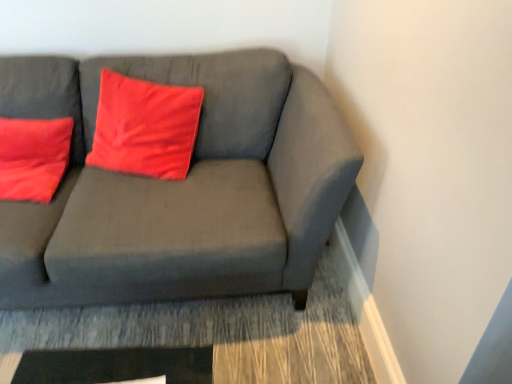
Question: Does point (159, 139) appear closer or farther from the camera than point (295, 235)?

Choices:
 (A) closer
 (B) farther

Answer: (B)

Question: In the image, is matte red pillow at center positioned in front of or behind matte gray couch at center?

Choices:
 (A) behind
 (B) front

Answer: (A)

Question: Based on their sizes in the image, would you say matte red pillow at center is bigger or smaller than matte gray couch at center?

Choices:
 (A) small
 (B) big

Answer: (A)

Question: From a real-world perspective, is matte gray couch at center positioned above or below matte red pillow at center?

Choices:
 (A) above
 (B) below

Answer: (B)

Question: Based on their positions, is matte gray couch at center located to the left or right of matte red pillow at center?

Choices:
 (A) left
 (B) right

Answer: (A)

Question: Is matte gray couch at center wider or thinner than matte red pillow at center?

Choices:
 (A) thin
 (B) wide

Answer: (B)

Question: Looking at the image, does matte gray couch at center seem bigger or smaller compared to matte red pillow at center?

Choices:
 (A) small
 (B) big

Answer: (B)